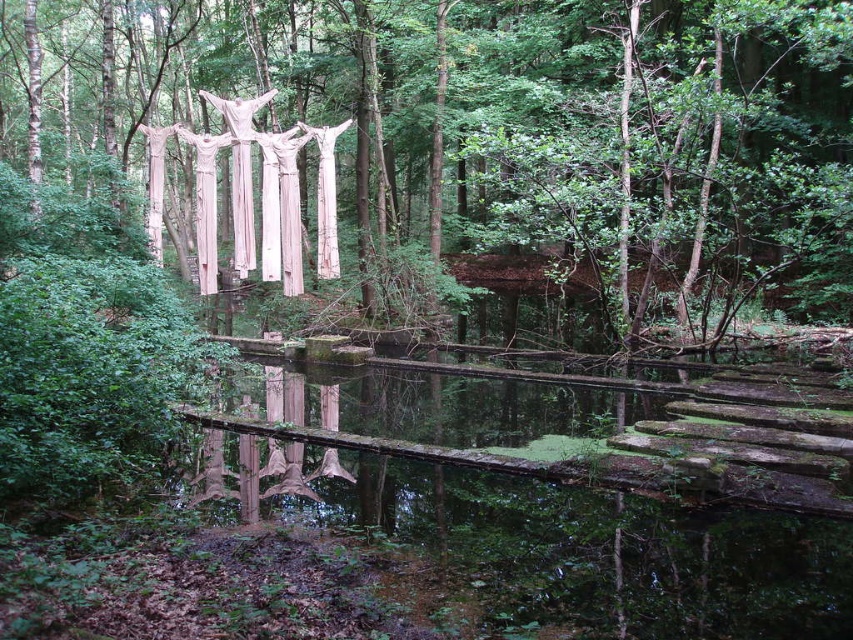
You are standing in the eerie forest scene and want to know how far the point marked as point (486,225) is from your current position. Can you determine the distance?

The point marked as point (486,225) is 29.58 meters away from the camera, so the distance from your current position would be approximately 29.58 meters.

You are a hiker who has stumbled upon this mysterious forest. You notice the smooth white sculpture at center and the green mossy water at center. Which object is taller in this scene?

The smooth white sculpture at center is much taller than the green mossy water at center, so the smooth white sculpture at center is taller.

Based on the scene described, which object is positioned to the left when observing the smooth white sculpture at center and the green mossy water at center?

The smooth white sculpture at center is positioned to the left of the green mossy water at center.